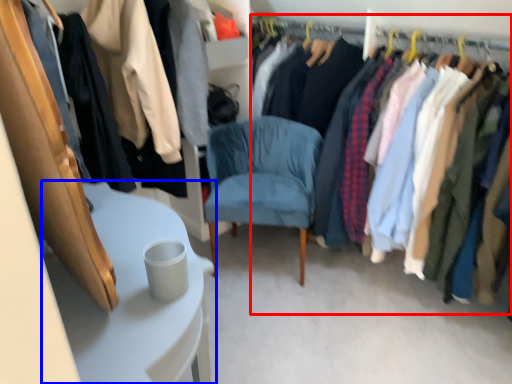
Question: Which object appears farthest to the camera in this image, closet (highlighted by a red box) or table (highlighted by a blue box)?

Choices:
 (A) closet
 (B) table

Answer: (A)